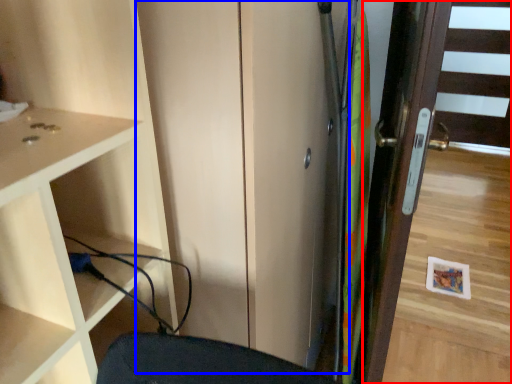
Question: Among these objects, which one is nearest to the camera, door (highlighted by a red box) or screen door (highlighted by a blue box)?

Choices:
 (A) door
 (B) screen door

Answer: (B)